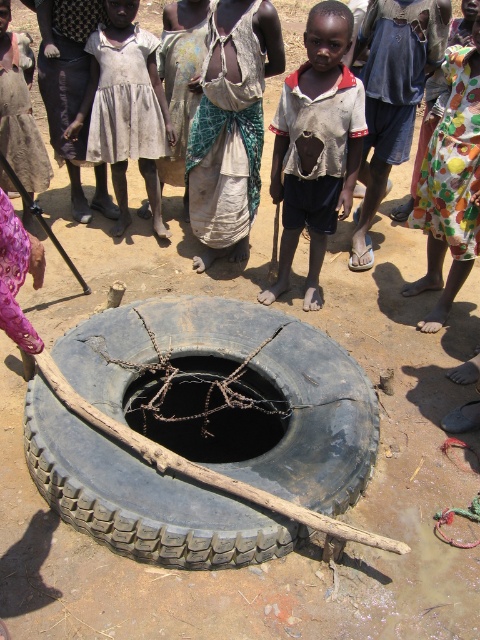
Question: Can you confirm if ripped white shirt at center is bigger than white fabric skirt at center?

Choices:
 (A) yes
 (B) no

Answer: (B)

Question: Considering the real-world distances, which object is farthest from the ripped white shirt at center?

Choices:
 (A) dark rubber tire at center
 (B) white fabric skirt at center

Answer: (A)

Question: Considering the relative positions of dark rubber tire at center and white cotton dress at center in the image provided, where is dark rubber tire at center located with respect to white cotton dress at center?

Choices:
 (A) left
 (B) right

Answer: (B)

Question: Among these points, which one is nearest to the camera?

Choices:
 (A) (175, 563)
 (B) (120, 116)
 (C) (285, 237)
 (D) (0, 264)

Answer: (D)

Question: Where is ripped white shirt at center located in relation to white fabric skirt at center in the image?

Choices:
 (A) below
 (B) above

Answer: (A)

Question: Which of the following is the closest to the observer?

Choices:
 (A) (333, 58)
 (B) (214, 216)
 (C) (107, 92)
 (D) (212, 403)

Answer: (A)